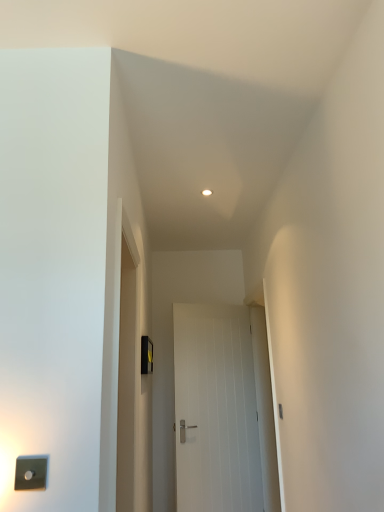
Question: Is black plastic light switch at center, placed as the 1th light switch when sorted from back to front, to the left or to the right of satin silver switch at lower left, arranged as the first light switch when viewed from the front, in the image?

Choices:
 (A) right
 (B) left

Answer: (A)

Question: In terms of height, does black plastic light switch at center, the 2th light switch when ordered from front to back, look taller or shorter compared to satin silver switch at lower left, positioned as the 2th light switch in back-to-front order?

Choices:
 (A) tall
 (B) short

Answer: (A)

Question: Which object is the farthest from the satin silver switch at lower left, positioned as the 2th light switch in back-to-front order?

Choices:
 (A) black plastic light switch at center, the first light switch when ordered from right to left
 (B) white smooth door at center

Answer: (B)

Question: Estimate the real-world distances between objects in this image. Which object is closer to the black plastic light switch at center, placed as the 1th light switch when sorted from back to front?

Choices:
 (A) satin silver switch at lower left, arranged as the 2th light switch when viewed from the right
 (B) white smooth door at center

Answer: (B)